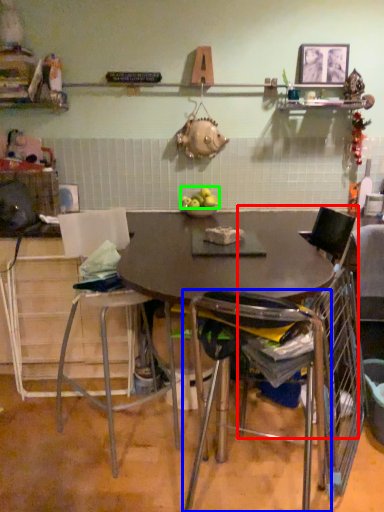
Question: Based on their relative distances, which object is farther from chair (highlighted by a red box)? Choose from chair (highlighted by a blue box) and apple (highlighted by a green box).

Choices:
 (A) chair
 (B) apple

Answer: (B)